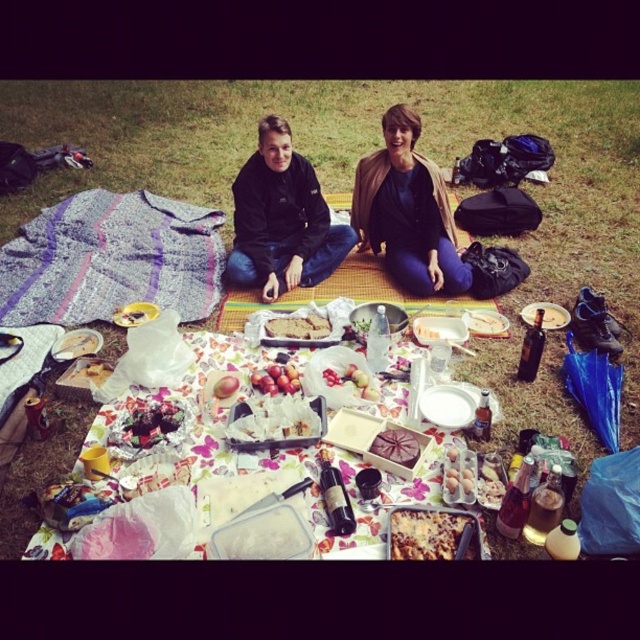
You are planning to serve both the dark chocolate cake at center and the slightly browned bread at center on the same plate. Which one will require a larger plate in terms of vertical space?

The slightly browned bread at center requires a larger plate in terms of vertical space because it is thicker than the dark chocolate cake at center.

You are planning to take a photo of the picnic setup. The dark chocolate cake at center and the white paper plate at center are both in the center. Which object should you focus on if you want to capture the tallest item in the scene?

The dark chocolate cake at center is much taller than the white paper plate at center, so you should focus on the dark chocolate cake at center to capture the tallest item in the scene.

You are planning to serve both the dark chocolate cake at center and the slightly browned bread at center to a group of guests. Based on the scene, which item would you estimate to have a bigger portion size?

The dark chocolate cake at center has a larger size compared to the slightly browned bread at center, so the dark chocolate cake at center would have a bigger portion size.